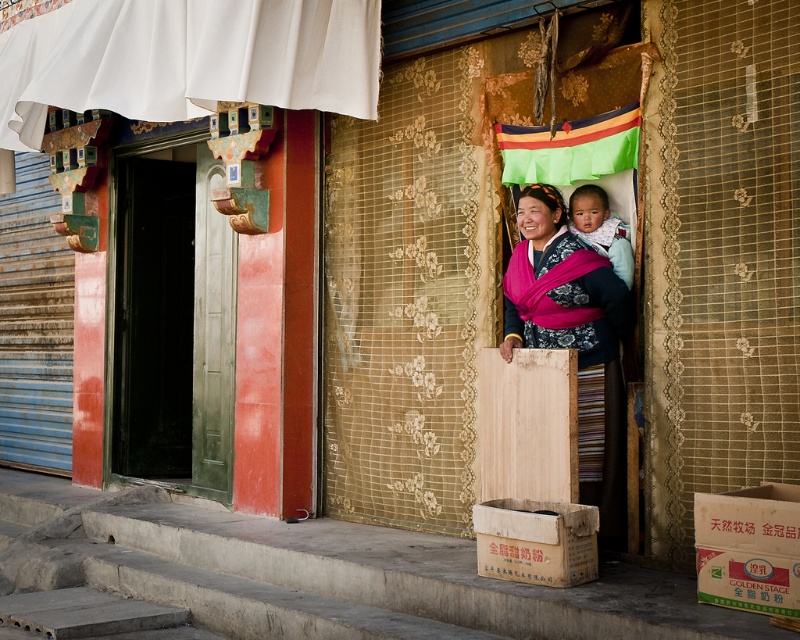
Question: Which object is the farthest from the white cardboard box at lower right?

Choices:
 (A) white fabric curtain at upper left
 (B) brown cardboard box at lower center
 (C) gold lace curtain at center

Answer: (A)

Question: Does white fabric curtain at upper left appear under brown cardboard box at lower center?

Choices:
 (A) yes
 (B) no

Answer: (B)

Question: Among these points, which one is farthest from the camera?

Choices:
 (A) (520, 196)
 (B) (722, 525)
 (C) (560, 532)

Answer: (A)

Question: Can you confirm if dark blue fabric at center is positioned to the right of white cardboard box at lower right?

Choices:
 (A) no
 (B) yes

Answer: (A)

Question: Observing the image, what is the correct spatial positioning of gold lace curtain at center in reference to dark blue fabric at center?

Choices:
 (A) left
 (B) right

Answer: (A)

Question: Which object is positioned farthest from the gold lace curtain at center?

Choices:
 (A) soft pink fabric baby at center
 (B) brown cardboard box at lower center

Answer: (B)